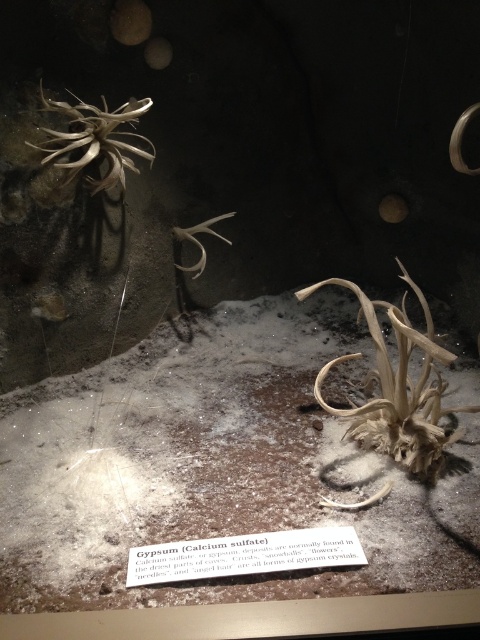
Is fibrous beige plant at center further to camera compared to light brown textured plant at upper left?

No.

Does fibrous beige plant at center have a smaller size compared to light brown textured plant at upper left?

No, fibrous beige plant at center is not smaller than light brown textured plant at upper left.

Measure the distance between fibrous beige plant at center and camera.

fibrous beige plant at center and camera are 1.30 meters apart from each other.

At what (x,y) coordinates should I click in order to perform the action: click on fibrous beige plant at center. Please return your answer as a coordinate pair (x, y). The height and width of the screenshot is (640, 480). Looking at the image, I should click on (396, 387).